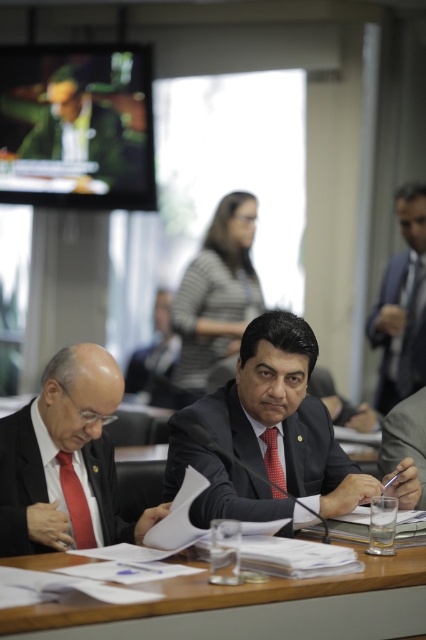
Question: Can you confirm if satin blue suit at right is wider than matte black suit at left?

Choices:
 (A) no
 (B) yes

Answer: (A)

Question: Among these points, which one is nearest to the camera?

Choices:
 (A) (103, 465)
 (B) (400, 316)
 (C) (394, 468)
 (D) (106, 148)

Answer: (A)

Question: Which object appears farthest from the camera in this image?

Choices:
 (A) red checkered tie at center
 (B) matte red tie at right
 (C) matte red tie at left

Answer: (B)

Question: Is satin blue suit at right closer to the viewer compared to matte red tie at right?

Choices:
 (A) no
 (B) yes

Answer: (B)

Question: Is wooden table at center bigger than red checkered tie at center?

Choices:
 (A) yes
 (B) no

Answer: (A)

Question: Which point is closer to the camera taking this photo?

Choices:
 (A) (313, 490)
 (B) (74, 508)
 (C) (215, 612)
 (D) (17, 413)

Answer: (C)